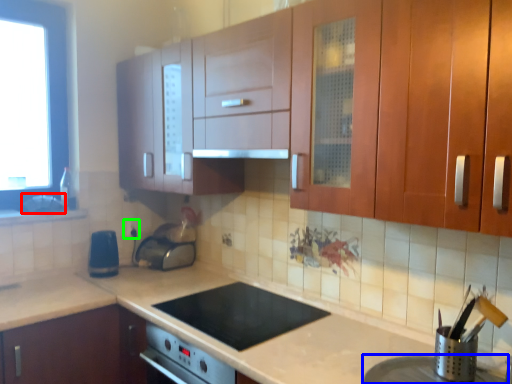
Question: Which object is the farthest from sink (highlighted by a red box)? Choose among these: appliance (highlighted by a blue box) or electric outlet (highlighted by a green box).

Choices:
 (A) appliance
 (B) electric outlet

Answer: (A)